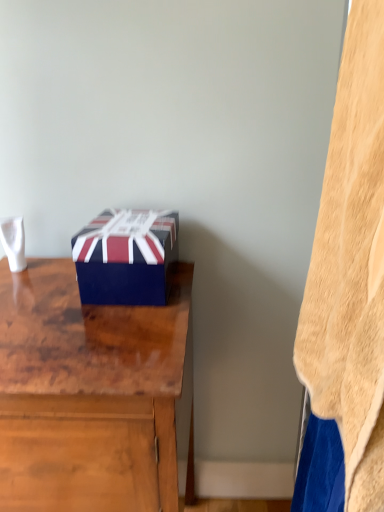
Locate an element on the screen. The image size is (384, 512). free space on the front side of blue glossy box at center is located at coordinates (107, 327).